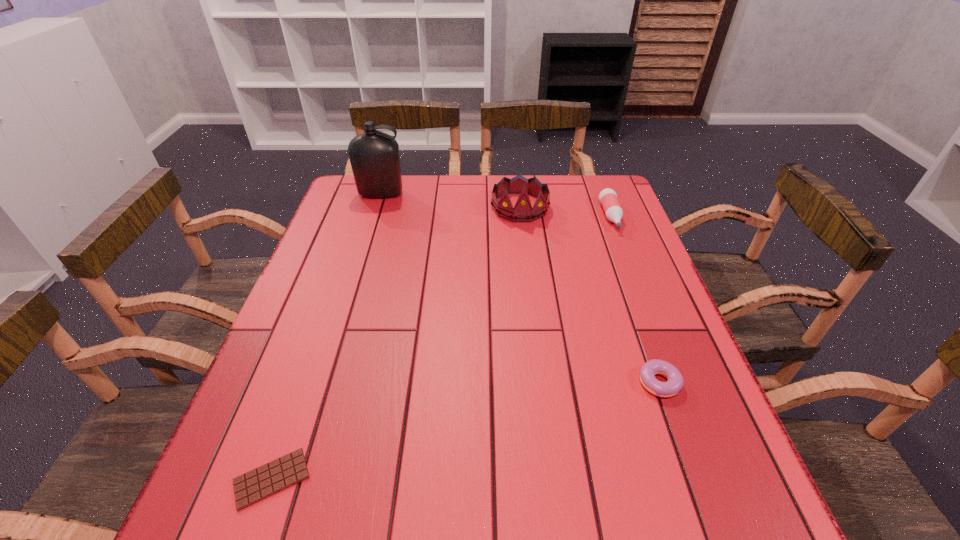
Where is `vacant area that lies between the shortest object and the right bottle`? The image size is (960, 540). vacant area that lies between the shortest object and the right bottle is located at coordinates (442, 347).

At what (x,y) coordinates should I click in order to perform the action: click on empty space that is in between the second shortest object and the shortest object. Please return your answer as a coordinate pair (x, y). Image resolution: width=960 pixels, height=540 pixels. Looking at the image, I should click on (466, 431).

Image resolution: width=960 pixels, height=540 pixels. I want to click on vacant area that lies between the nearest object and the shorter bottle, so click(x=442, y=347).

Locate an element on the screen. blank region between the nearest object and the right bottle is located at coordinates 442,347.

Identify the location of empty space between the second nearest object and the shorter bottle. (635, 300).

Find the location of a particular element. vacant space that is in between the taller bottle and the doughnut is located at coordinates (519, 289).

Locate an element on the screen. The image size is (960, 540). free space between the taller bottle and the candy bar is located at coordinates (326, 336).

Locate which object is the third closest to the taller bottle. Please provide its 2D coordinates. Your answer should be formatted as a tuple, i.e. [(x, y)], where the tuple contains the x and y coordinates of a point satisfying the conditions above.

[(260, 483)]

Identify the location of object that can be found as the third closest to the tiara. The image size is (960, 540). (675, 382).

This screenshot has width=960, height=540. Identify the location of vacant region that satisfies the following two spatial constraints: 1. on the back side of the fourth tallest object; 2. on the left side of the candy bar. (304, 383).